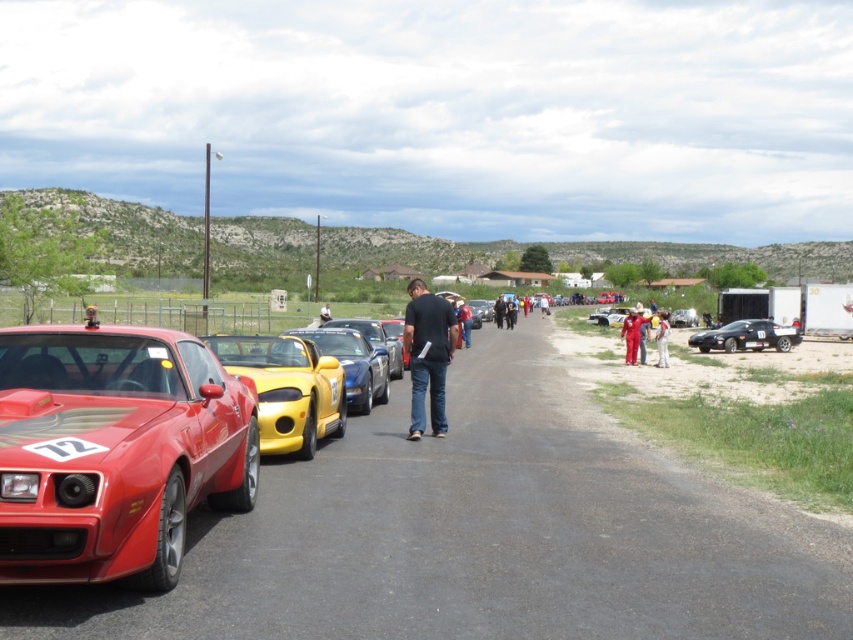
You are a photographer standing on the right side of the road. You want to take a photo of the shiny yellow convertible at center without including the smooth asphalt road at center in the background. Is this possible given their positions?

The smooth asphalt road at center is in front of the shiny yellow convertible at center, so the road would block the view of the convertible. Therefore, it is not possible to take a photo of the shiny yellow convertible at center without including the smooth asphalt road at center in the background.

Based on the photo, you are a photographer trying to capture a wide shot of the shiny yellow convertible at center and the blue denim jeans at center. Your camera can only capture objects up to 2 meters wide. Which object might not fit in the frame?

The shiny yellow convertible at center has a larger width than the blue denim jeans at center, so the shiny yellow convertible at center might not fit in the frame since it exceeds the 2 meters width limit.